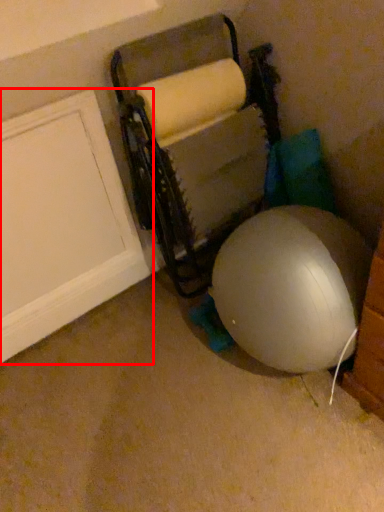
Question: From the image, what is the correct spatial relationship of door (annotated by the red box) in relation to bean bag chair?

Choices:
 (A) left
 (B) right

Answer: (A)